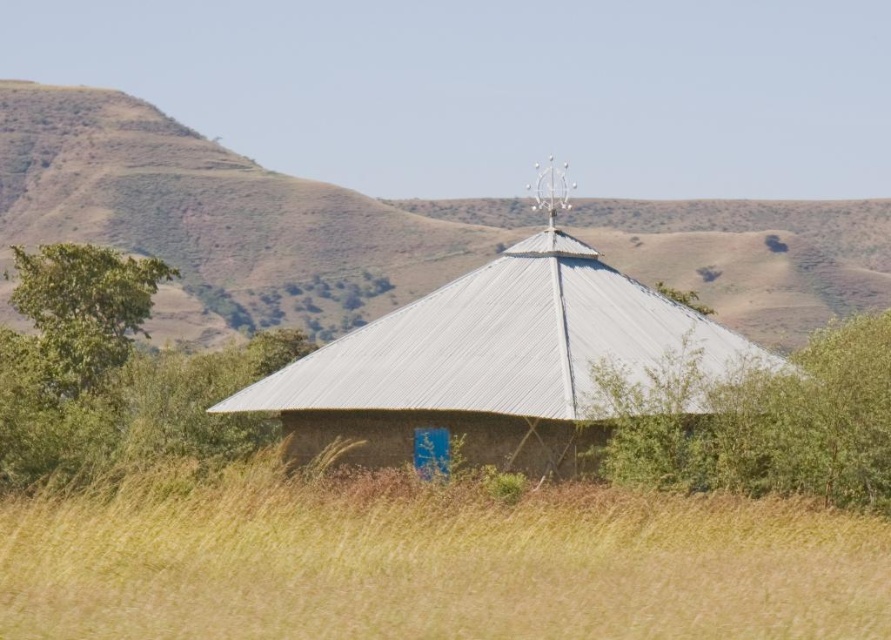
Which is behind, point (72, 630) or point (48, 348)?

Positioned behind is point (48, 348).

Where is `dry grass at center`? The image size is (891, 640). dry grass at center is located at coordinates (434, 563).

Who is positioned more to the right, dry grass at center or green leafy bush at lower right?

green leafy bush at lower right

Is dry grass at center smaller than green leafy bush at lower right?

Correct, dry grass at center occupies less space than green leafy bush at lower right.

The height and width of the screenshot is (640, 891). Identify the location of dry grass at center. (434, 563).

This screenshot has height=640, width=891. What are the coordinates of `green leafy bush at lower right` in the screenshot? It's located at (770, 426).

Which is behind, point (779, 403) or point (35, 326)?

The point (35, 326) is more distant.

Locate an element on the screen. green leafy bush at lower right is located at coordinates tap(770, 426).